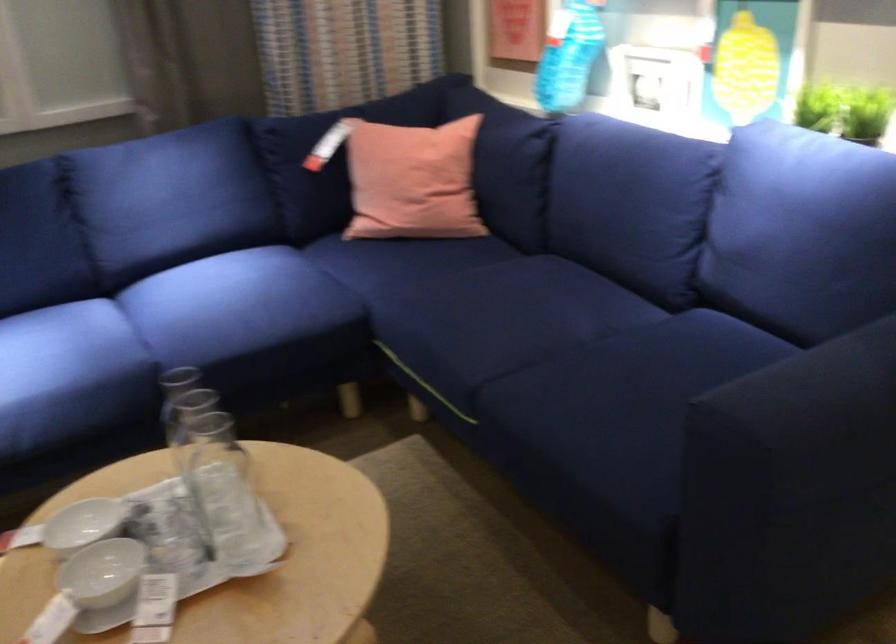
The image size is (896, 644). What are the coordinates of `glass carafe` in the screenshot? It's located at (222, 491).